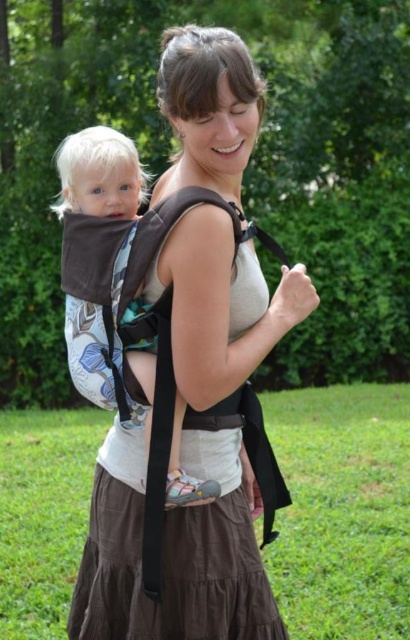
You are a photographer standing 2 meters away from the scene. You want to take a closeup shot of the brown fabric carrier at center without moving closer. Can you use a zoom lens with a maximum focal length of 200mm to achieve this?

The brown fabric carrier at center is 1.84 meters away from the viewer. Since the photographer is already 2 meters away, the carrier is within the focal range. Using a 200mm zoom lens should allow capturing a clear closeup without needing to move closer.

You are a photographer setting up a shot of the woman and child. You need to position a small reflector to bounce light onto the lower part of the brown fabric carrier at center without affecting the black fabric strap at upper center. Based on their positions, where should you place the reflector relative to the woman?

The brown fabric carrier at center is above the black fabric strap at upper center, so to light the lower part of the brown fabric carrier without affecting the strap, place the reflector below the woman to bounce light upward towards the carrier.

You are a photographer setting up a shot of the woman and child. The brown fabric carrier at center and black fabric strap at upper center are both in the frame. Which object is taller?

The brown fabric carrier at center is much taller than the black fabric strap at upper center.